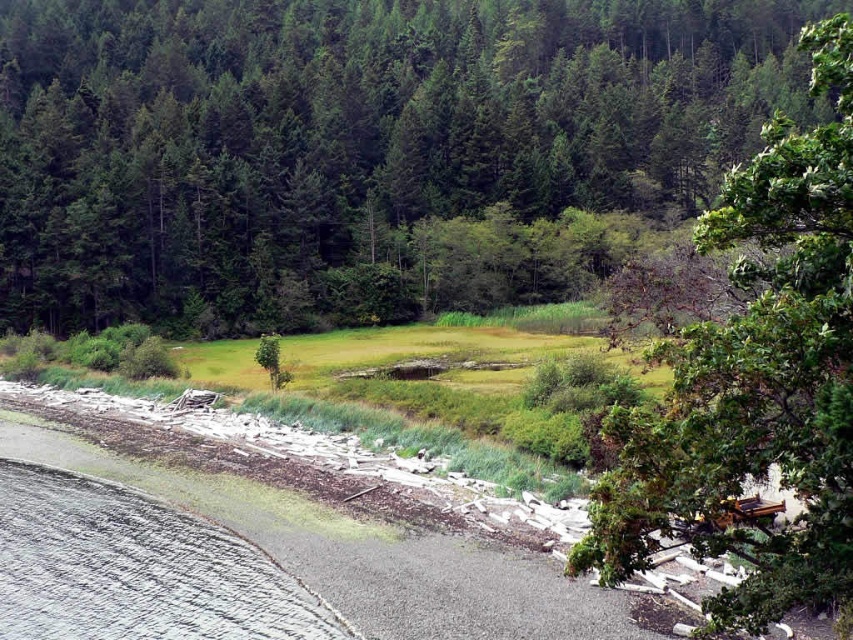
Between green leafy tree at center and green leafy tree at upper right, which one appears on the right side from the viewer's perspective?

From the viewer's perspective, green leafy tree at upper right appears more on the right side.

This screenshot has height=640, width=853. What do you see at coordinates (349, 131) in the screenshot?
I see `green leafy tree at center` at bounding box center [349, 131].

Measure the distance between point [540,152] and camera.

They are 128.13 meters apart.

At what (x,y) coordinates should I click in order to perform the action: click on green leafy tree at center. Please return your answer as a coordinate pair (x, y). This screenshot has height=640, width=853. Looking at the image, I should click on (349, 131).